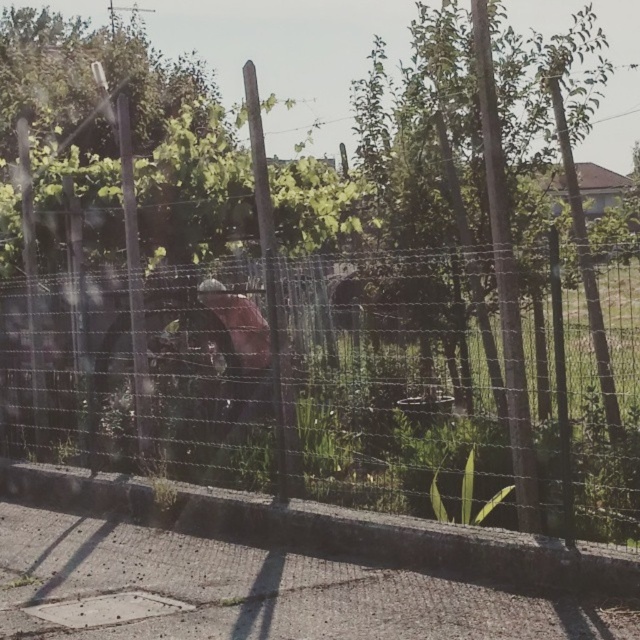
You are standing in a field and see the wire mesh fence at center and the green leafy tree at center. Which object is positioned to the left from your perspective?

The wire mesh fence at center is to the left of the green leafy tree at center from your perspective.